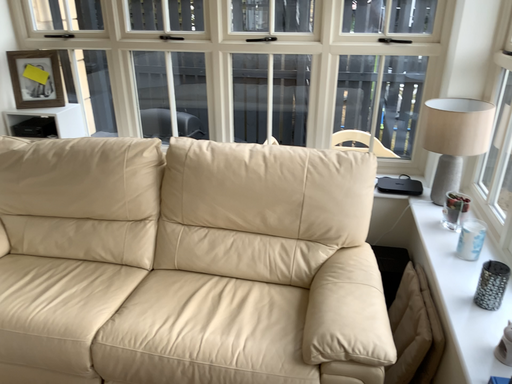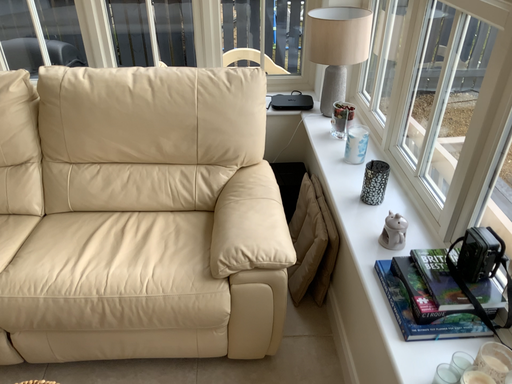
Question: How did the camera likely rotate when shooting the video?

Choices:
 (A) rotated upward
 (B) rotated downward

Answer: (B)